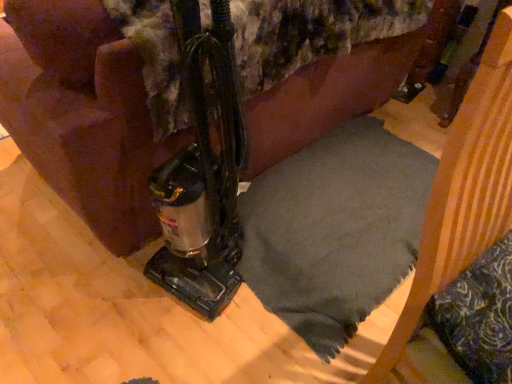
Find the location of a particular element. This screenshot has height=384, width=512. velvety green pillow at lower right is located at coordinates (478, 316).

Image resolution: width=512 pixels, height=384 pixels. What do you see at coordinates (478, 316) in the screenshot?
I see `velvety green pillow at lower right` at bounding box center [478, 316].

Locate an element on the screen. The image size is (512, 384). dark gray fabric cushion at center is located at coordinates (464, 191).

This screenshot has width=512, height=384. Describe the element at coordinates (464, 191) in the screenshot. I see `dark gray fabric cushion at center` at that location.

In order to face dark gray fabric cushion at center, should I rotate leftwards or rightwards?

To face it directly, rotate right by 28.648 degrees.

Locate an element on the screen. This screenshot has height=384, width=512. velvety green pillow at lower right is located at coordinates (478, 316).

Considering the relative positions of dark gray fabric cushion at center and velvety green pillow at lower right in the image provided, is dark gray fabric cushion at center to the left or to the right of velvety green pillow at lower right?

dark gray fabric cushion at center is positioned on velvety green pillow at lower right's right side.

Is dark gray fabric cushion at center closer to the viewer compared to velvety green pillow at lower right?

Yes, it is in front of velvety green pillow at lower right.

Is point (502, 179) positioned in front of point (508, 275)?

Yes, it is.

From the image's perspective, which one is positioned higher, dark gray fabric cushion at center or velvety green pillow at lower right?

From the image's view, dark gray fabric cushion at center is above.

From a real-world perspective, is dark gray fabric cushion at center positioned above or below velvety green pillow at lower right?

In terms of real-world spatial position, dark gray fabric cushion at center is above velvety green pillow at lower right.

Is dark gray fabric cushion at center wider or thinner than velvety green pillow at lower right?

Considering their sizes, dark gray fabric cushion at center looks slimmer than velvety green pillow at lower right.

Can you confirm if dark gray fabric cushion at center is taller than velvety green pillow at lower right?

Yes, dark gray fabric cushion at center is taller than velvety green pillow at lower right.

Considering the sizes of objects dark gray fabric cushion at center and velvety green pillow at lower right in the image provided, who is smaller, dark gray fabric cushion at center or velvety green pillow at lower right?

velvety green pillow at lower right is smaller.

Is dark gray fabric cushion at center not within velvety green pillow at lower right?

That's correct, dark gray fabric cushion at center is outside of velvety green pillow at lower right.

Would you consider dark gray fabric cushion at center to be distant from velvety green pillow at lower right?

dark gray fabric cushion at center is near velvety green pillow at lower right, not far away.

Could you tell me if dark gray fabric cushion at center is facing velvety green pillow at lower right?

Yes, dark gray fabric cushion at center is turned towards velvety green pillow at lower right.

What's the angular difference between dark gray fabric cushion at center and velvety green pillow at lower right's facing directions?

They differ by 94.8 degrees in their facing directions.

I want to click on furniture above the velvety green pillow at lower right (from the image's perspective), so click(464, 191).

Between velvety green pillow at lower right and dark gray fabric cushion at center, which one appears on the right side from the viewer's perspective?

Positioned to the right is dark gray fabric cushion at center.

Between velvety green pillow at lower right and dark gray fabric cushion at center, which one is positioned in front?

dark gray fabric cushion at center is closer to the camera.

Is point (497, 247) closer or farther from the camera than point (493, 91)?

Clearly, point (497, 247) is more distant from the camera than point (493, 91).

In the scene shown: From the image's perspective, which object appears higher, velvety green pillow at lower right or dark gray fabric cushion at center?

From the image's view, dark gray fabric cushion at center is above.

From a real-world perspective, is velvety green pillow at lower right above or below dark gray fabric cushion at center?

From a real-world perspective, velvety green pillow at lower right is physically below dark gray fabric cushion at center.

Can you confirm if velvety green pillow at lower right is thinner than dark gray fabric cushion at center?

In fact, velvety green pillow at lower right might be wider than dark gray fabric cushion at center.

Can you confirm if velvety green pillow at lower right is shorter than dark gray fabric cushion at center?

Indeed, velvety green pillow at lower right has a lesser height compared to dark gray fabric cushion at center.

Looking at the image, does velvety green pillow at lower right seem bigger or smaller compared to dark gray fabric cushion at center?

Clearly, velvety green pillow at lower right is smaller in size than dark gray fabric cushion at center.

Can we say velvety green pillow at lower right lies outside dark gray fabric cushion at center?

No, most part of velvety green pillow at lower right lies within dark gray fabric cushion at center.

Is velvety green pillow at lower right directly adjacent to dark gray fabric cushion at center?

No, velvety green pillow at lower right is not touching dark gray fabric cushion at center.

Is velvety green pillow at lower right turned away from dark gray fabric cushion at center?

Yes.

Looking at this image, how different are the orientations of velvety green pillow at lower right and dark gray fabric cushion at center in degrees?

velvety green pillow at lower right and dark gray fabric cushion at center are facing 94.8 degrees away from each other.

Measure the distance from velvety green pillow at lower right to dark gray fabric cushion at center.

They are 6.39 inches apart.

You are a GUI agent. You are given a task and a screenshot of the screen. Output one action in this format:
    pyautogui.click(x=<x>, y=<y>)
    Task: Click on the furniture positioned vertically above the velvety green pillow at lower right (from a real-world perspective)
    
    Given the screenshot: What is the action you would take?
    pyautogui.click(x=464, y=191)

At what (x,y) coordinates should I click in order to perform the action: click on pillow below the dark gray fabric cushion at center (from the image's perspective). Please return your answer as a coordinate pair (x, y). The height and width of the screenshot is (384, 512). Looking at the image, I should click on (478, 316).

This screenshot has height=384, width=512. I want to click on pillow lying on the left of dark gray fabric cushion at center, so click(x=478, y=316).